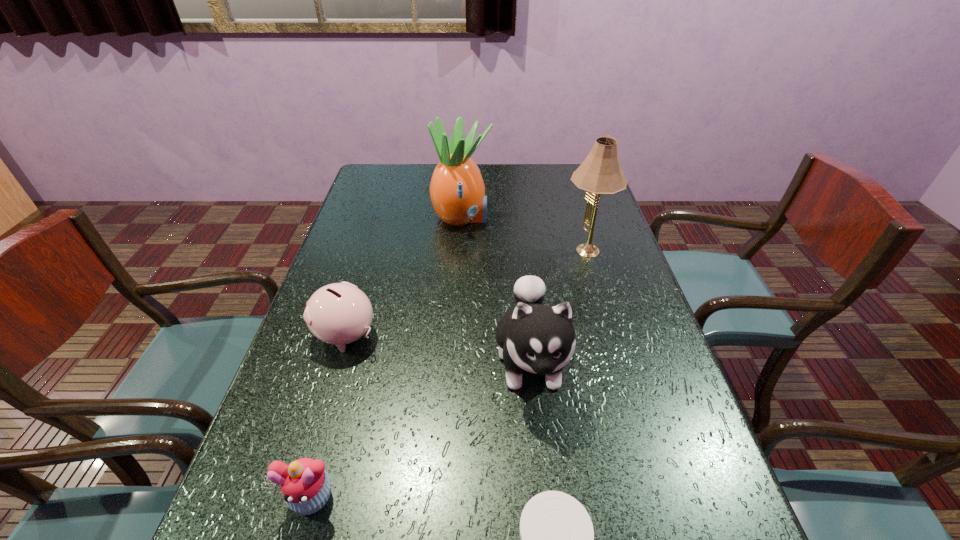
The image size is (960, 540). Identify the location of vacant space located 0.210m on the right of the piggy bank. (468, 335).

Locate an element on the screen. piggy bank that is at the left edge is located at coordinates point(339,313).

Find the location of `cupcake at the left edge`. cupcake at the left edge is located at coordinates (305, 485).

Find the location of a particular element. The image size is (960, 540). object positioned at the right edge is located at coordinates (600, 173).

Find the location of a particular element. The height and width of the screenshot is (540, 960). vacant space at the far edge is located at coordinates (502, 193).

The width and height of the screenshot is (960, 540). I want to click on free space at the left edge of the desktop, so click(341, 377).

In order to click on blank space at the right edge in this screenshot , I will do pyautogui.click(x=602, y=305).

The width and height of the screenshot is (960, 540). What are the coordinates of `vacant space at the far left corner of the desktop` in the screenshot? It's located at (406, 170).

Where is `free space between the cupcake and the piggy bank`? The height and width of the screenshot is (540, 960). free space between the cupcake and the piggy bank is located at coordinates (328, 416).

The width and height of the screenshot is (960, 540). What are the coordinates of `vacant space that is in between the farthest object and the cupcake` in the screenshot? It's located at (387, 358).